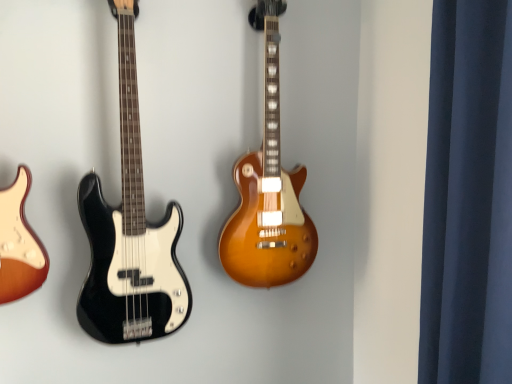
Question: Does dark blue fabric at right have a greater height compared to black glossy bass guitar at left, which is the 1th guitar from left to right?

Choices:
 (A) yes
 (B) no

Answer: (B)

Question: Is black glossy bass guitar at left, which is the 1th guitar from left to right, located within dark blue fabric at right?

Choices:
 (A) no
 (B) yes

Answer: (A)

Question: From the image's perspective, would you say dark blue fabric at right is positioned over black glossy bass guitar at left, which is the 2th guitar in right-to-left order?

Choices:
 (A) yes
 (B) no

Answer: (B)

Question: Does dark blue fabric at right appear on the left side of black glossy bass guitar at left, which is the 2th guitar in right-to-left order?

Choices:
 (A) yes
 (B) no

Answer: (B)

Question: Does dark blue fabric at right have a smaller size compared to black glossy bass guitar at left, which is the 1th guitar from left to right?

Choices:
 (A) yes
 (B) no

Answer: (B)

Question: Is black glossy bass guitar at left, which is the 2th guitar in right-to-left order, spatially inside satin sunburst guitar at center, which appears as the 2th guitar when viewed from the left, or outside of it?

Choices:
 (A) inside
 (B) outside

Answer: (B)

Question: Considering the positions of black glossy bass guitar at left, which is the 2th guitar in right-to-left order, and satin sunburst guitar at center, which is counted as the 1th guitar, starting from the right, in the image, is black glossy bass guitar at left, which is the 2th guitar in right-to-left order, wider or thinner than satin sunburst guitar at center, which is counted as the 1th guitar, starting from the right,?

Choices:
 (A) wide
 (B) thin

Answer: (A)

Question: Does point (76, 309) appear closer or farther from the camera than point (267, 59)?

Choices:
 (A) closer
 (B) farther

Answer: (B)

Question: In terms of height, does black glossy bass guitar at left, which is the 1th guitar from left to right, look taller or shorter compared to satin sunburst guitar at center, which is counted as the 1th guitar, starting from the right?

Choices:
 (A) tall
 (B) short

Answer: (A)

Question: Considering their positions, is dark blue fabric at right located in front of or behind black glossy bass guitar at left, which is the 1th guitar from left to right?

Choices:
 (A) behind
 (B) front

Answer: (B)

Question: From the image's perspective, is dark blue fabric at right positioned above or below black glossy bass guitar at left, which is the 2th guitar in right-to-left order?

Choices:
 (A) above
 (B) below

Answer: (B)

Question: Looking at their shapes, would you say dark blue fabric at right is wider or thinner than black glossy bass guitar at left, which is the 1th guitar from left to right?

Choices:
 (A) thin
 (B) wide

Answer: (B)

Question: From a real-world perspective, relative to black glossy bass guitar at left, which is the 1th guitar from left to right, is dark blue fabric at right vertically above or below?

Choices:
 (A) below
 (B) above

Answer: (A)

Question: Is satin sunburst guitar at center, which appears as the 2th guitar when viewed from the left, to the left or to the right of black glossy bass guitar at left, which is the 2th guitar in right-to-left order, in the image?

Choices:
 (A) right
 (B) left

Answer: (A)

Question: Is point (253, 165) closer or farther from the camera than point (91, 306)?

Choices:
 (A) closer
 (B) farther

Answer: (B)